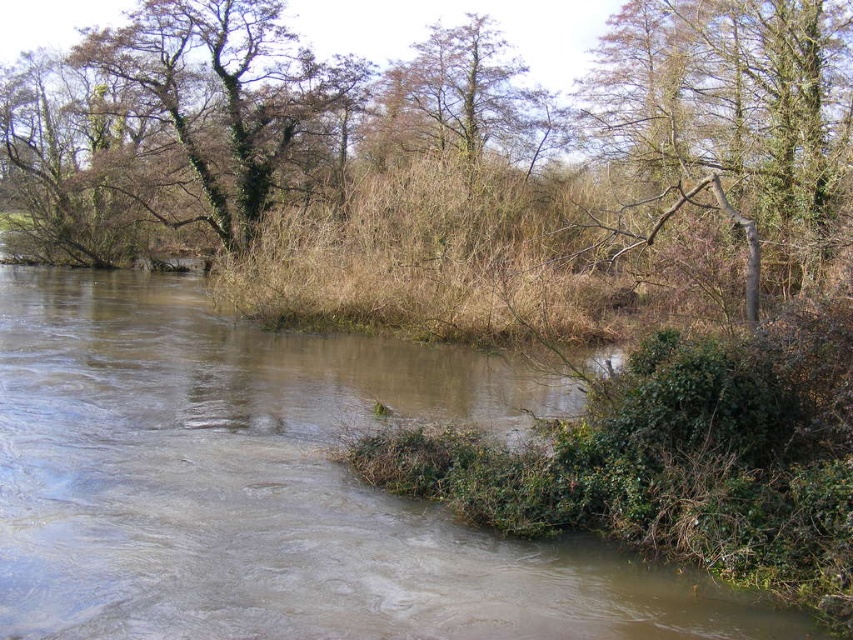
Question: Which point is closer to the camera?

Choices:
 (A) (76, 310)
 (B) (804, 106)
 (C) (717, 13)
 (D) (310, 76)

Answer: (B)

Question: Is brown leafy tree at upper center smaller than brown rough tree at upper right?

Choices:
 (A) no
 (B) yes

Answer: (A)

Question: Which object is the closest to the brown leafy tree at upper center?

Choices:
 (A) green leafy tree at upper left
 (B) brown muddy river at center
 (C) brown rough tree at upper right

Answer: (C)

Question: Among these objects, which one is farthest from the camera?

Choices:
 (A) brown rough tree at upper right
 (B) brown leafy tree at upper center

Answer: (B)

Question: Can you confirm if brown muddy river at center is positioned above brown rough tree at upper right?

Choices:
 (A) yes
 (B) no

Answer: (B)

Question: Can you confirm if brown muddy river at center is thinner than brown rough tree at upper right?

Choices:
 (A) yes
 (B) no

Answer: (B)